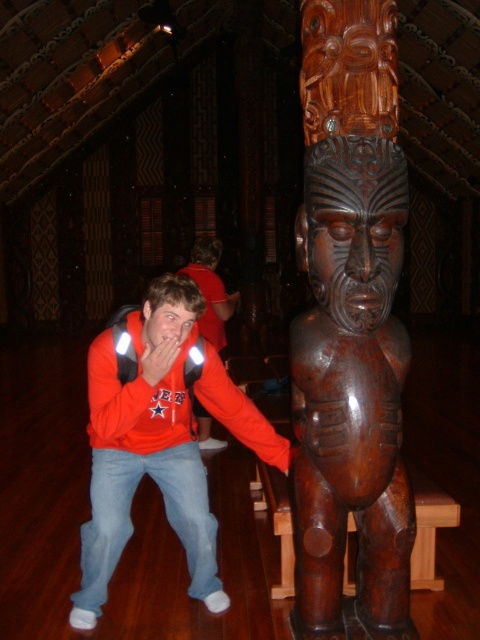
You are an interior designer planning to place a new sculpture in the wharenui. The sculpture is 1.2 meters wide. You see the brown polished wood statue at center and the matte red hoodie at center. Which object should you avoid placing the sculpture next to to ensure there is enough space?

You should avoid placing the sculpture next to the brown polished wood statue at center because it is thinner than the matte red hoodie at center, meaning the statue requires less space. The sculpture might fit better next to the wider matte red hoodie at center to ensure adequate spacing.

You are a visitor in this traditional Maori meeting house and want to take a photo of both the brown polished wood statue at center and the orange fleece jacket at center. Since you want to include both in the frame, which object should you focus on to ensure both are visible?

The brown polished wood statue at center is much taller than the orange fleece jacket at center, so focusing on the statue will help ensure both are visible in the frame.

You are a photographer taking a photo of the traditional Maori meeting house. You notice two jackets hanging on a rack in the foreground. The orange fleece jacket at center and the matte red hoodie at center. Which jacket is to the right of the other?

The orange fleece jacket at center is positioned on the right side of matte red hoodie at center.